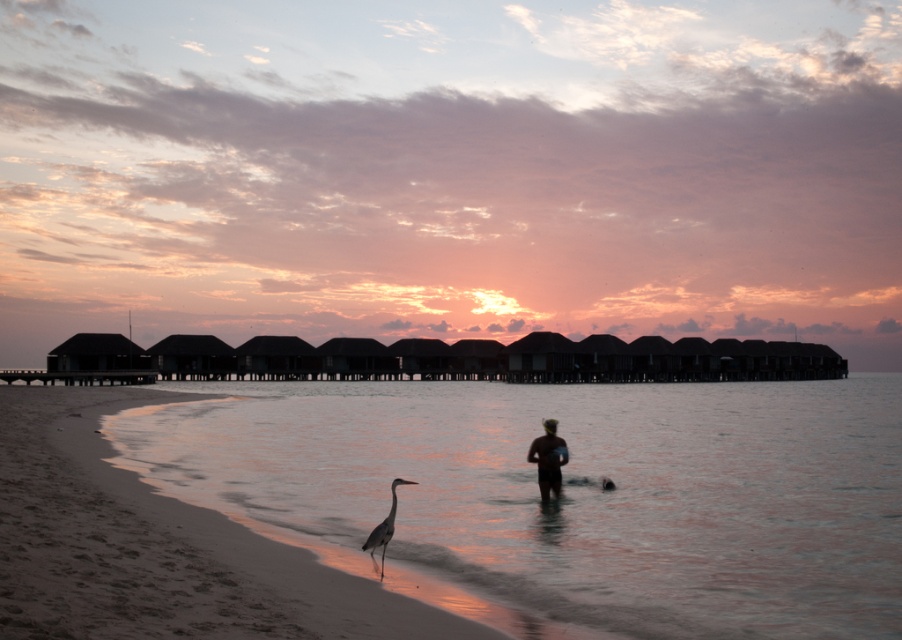
Question: Which point is farther from the camera taking this photo?

Choices:
 (A) (329, 515)
 (B) (263, 557)

Answer: (A)

Question: Which object appears closest to the camera in this image?

Choices:
 (A) black matte swimwear at center
 (B) sandy water at lower left
 (C) sandy beach at lower left

Answer: (C)

Question: Is sandy water at lower left smaller than black matte swimwear at center?

Choices:
 (A) yes
 (B) no

Answer: (B)

Question: Does sandy water at lower left appear over gray matte bird at lower center?

Choices:
 (A) yes
 (B) no

Answer: (B)

Question: Which object is the farthest from the sandy beach at lower left?

Choices:
 (A) sandy water at lower left
 (B) black matte swimwear at center

Answer: (A)

Question: Is sandy beach at lower left further to camera compared to gray matte bird at lower center?

Choices:
 (A) yes
 (B) no

Answer: (B)